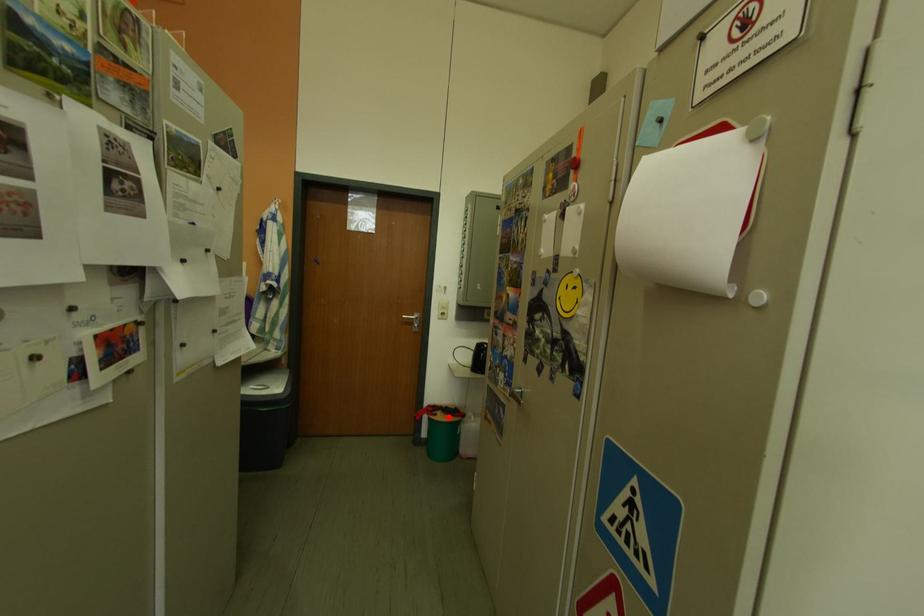
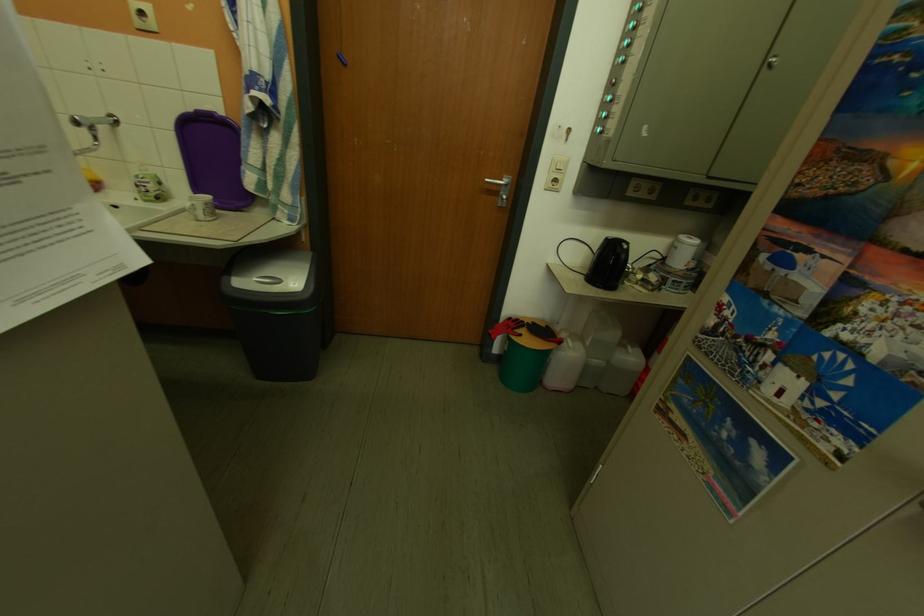
The point at the highlighted location is marked in the first image. Where is the corresponding point in the second image?

(533, 338)